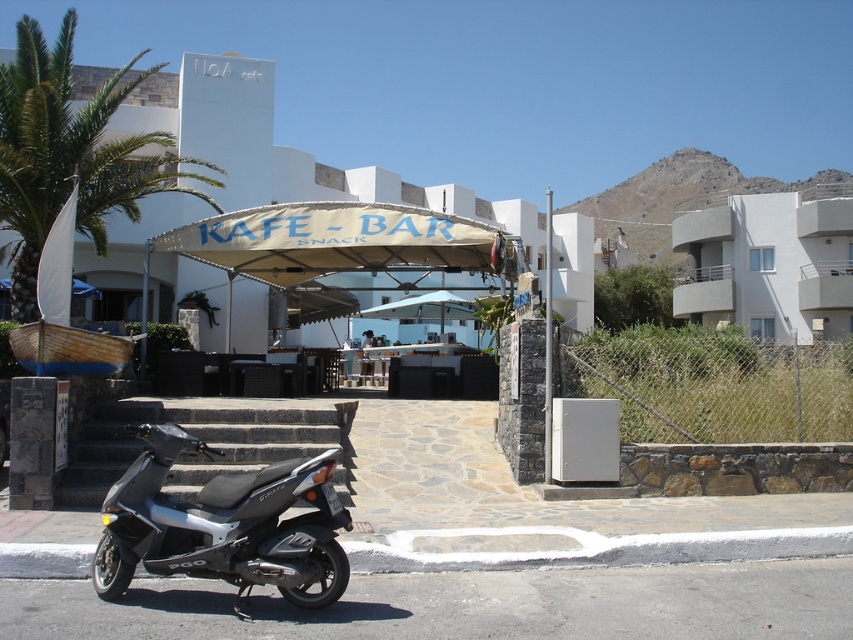
Question: Does silver metallic scooter at lower left have a smaller size compared to green leafy palm tree at upper left?

Choices:
 (A) no
 (B) yes

Answer: (B)

Question: Which object is closer to the camera taking this photo?

Choices:
 (A) white matte building at center
 (B) green leafy palm tree at upper left

Answer: (B)

Question: From the image, what is the correct spatial relationship of white matte building at center in relation to silver metallic scooter at lower left?

Choices:
 (A) right
 (B) left

Answer: (A)

Question: Does green leafy palm tree at upper left lie behind white smooth building at upper right?

Choices:
 (A) no
 (B) yes

Answer: (A)

Question: Which object is closer to the camera taking this photo?

Choices:
 (A) white matte building at center
 (B) white smooth building at upper right

Answer: (A)

Question: Which of the following is the farthest from the observer?

Choices:
 (A) silver metallic scooter at lower left
 (B) green leafy palm tree at upper left
 (C) white matte building at center
 (D) white smooth building at upper right

Answer: (D)